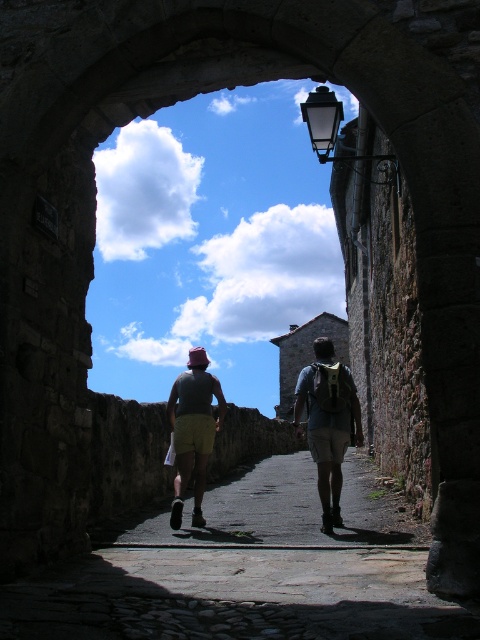
Is gray fabric shorts at center thinner than matte gray shirt at center?

No.

Does gray fabric shorts at center have a greater height compared to matte gray shirt at center?

Correct, gray fabric shorts at center is much taller as matte gray shirt at center.

Between point (328, 467) and point (206, 417), which one is positioned in front?

Point (328, 467) is more forward.

Where is `gray fabric shorts at center`? The height and width of the screenshot is (640, 480). gray fabric shorts at center is located at coordinates (327, 422).

From the picture: Can you confirm if gray fabric shorts at center is wider than matte gray backpack at center?

Correct, the width of gray fabric shorts at center exceeds that of matte gray backpack at center.

Does point (336, 417) lie in front of point (338, 524)?

No, (336, 417) is behind (338, 524).

Where is `gray fabric shorts at center`? The width and height of the screenshot is (480, 640). gray fabric shorts at center is located at coordinates (327, 422).

Between matte gray backpack at center and matte gray shirt at center, which one appears on the left side from the viewer's perspective?

matte gray shirt at center is more to the left.

In the scene shown: Can you confirm if matte gray backpack at center is positioned to the left of matte gray shirt at center?

In fact, matte gray backpack at center is to the right of matte gray shirt at center.

Does point (313, 444) come closer to viewer compared to point (193, 369)?

Yes, point (313, 444) is closer to viewer.

The height and width of the screenshot is (640, 480). What are the coordinates of `matte gray backpack at center` in the screenshot? It's located at (327, 422).